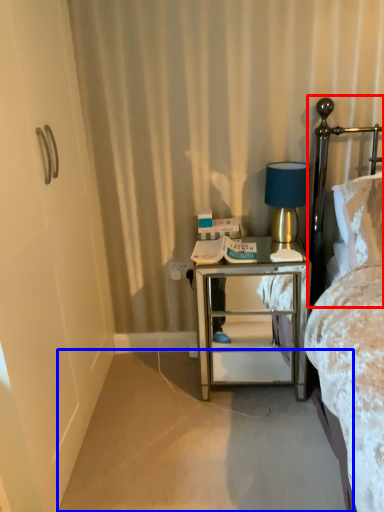
Question: Which object appears closest to the camera in this image, headboard (highlighted by a red box) or plain (highlighted by a blue box)?

Choices:
 (A) headboard
 (B) plain

Answer: (B)